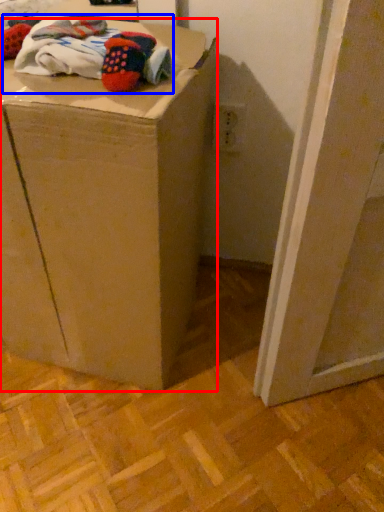
Question: Which object is closer to the camera taking this photo, furniture (highlighted by a red box) or laundry (highlighted by a blue box)?

Choices:
 (A) furniture
 (B) laundry

Answer: (A)